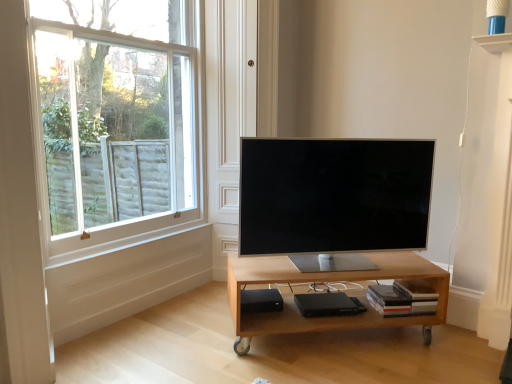
Question: Would you say black matte speaker at lower center is to the left or to the right of light wood/matte table at center in the picture?

Choices:
 (A) left
 (B) right

Answer: (A)

Question: In terms of width, does black matte speaker at lower center look wider or thinner when compared to light wood/matte table at center?

Choices:
 (A) thin
 (B) wide

Answer: (A)

Question: Based on their relative distances, which object is nearer to the satin silver tv at center?

Choices:
 (A) white wood window at upper left
 (B) black matte speaker at lower center
 (C) light wood/matte table at center

Answer: (C)

Question: Considering the real-world distances, which object is farthest from the light wood/matte table at center?

Choices:
 (A) satin silver tv at center
 (B) white wood window at upper left
 (C) black matte speaker at lower center

Answer: (B)